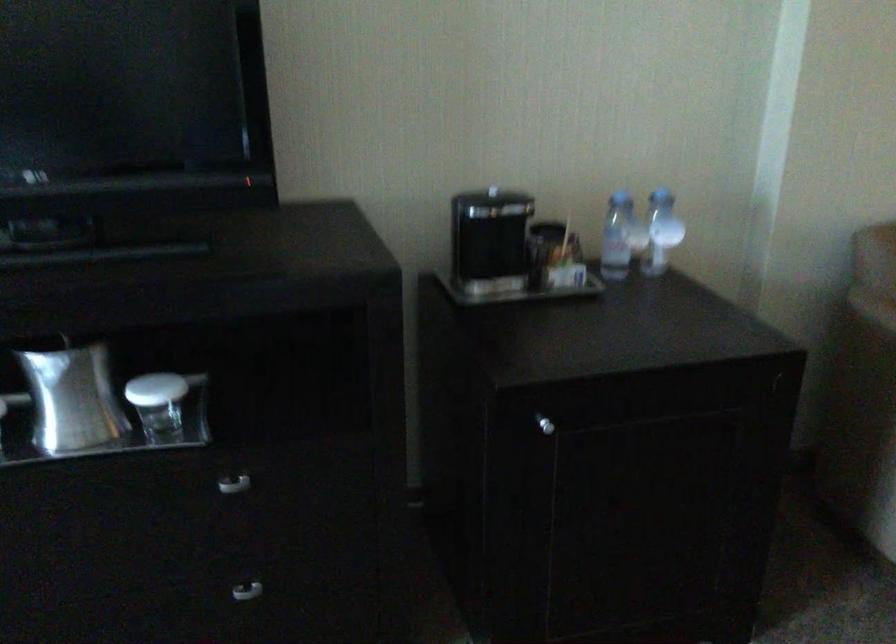
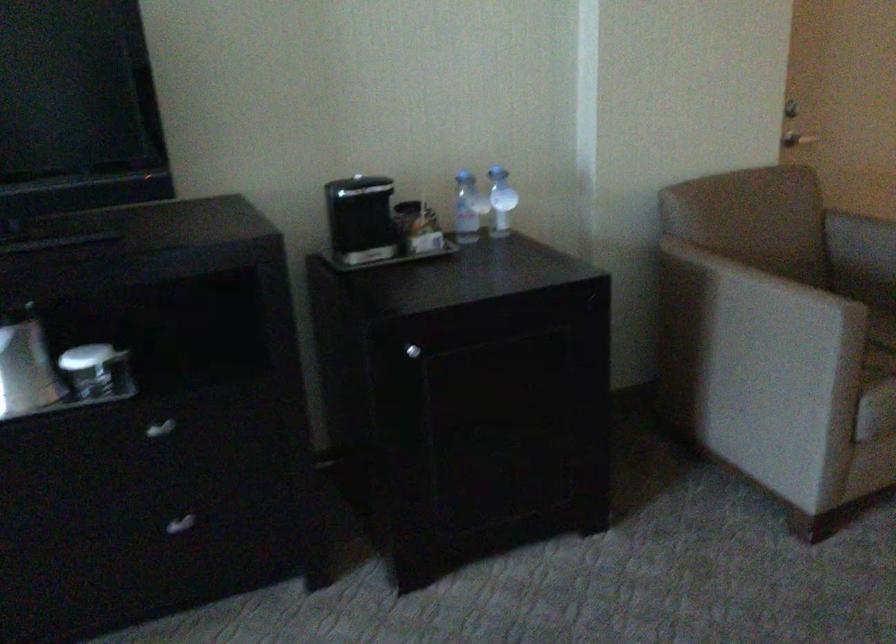
Question: Which direction would the cameraman need to move to produce the second image? Reply with the corresponding letter.

Choices:
 (A) Left
 (B) Right
 (C) Forward
 (D) Backward

Answer: (D)